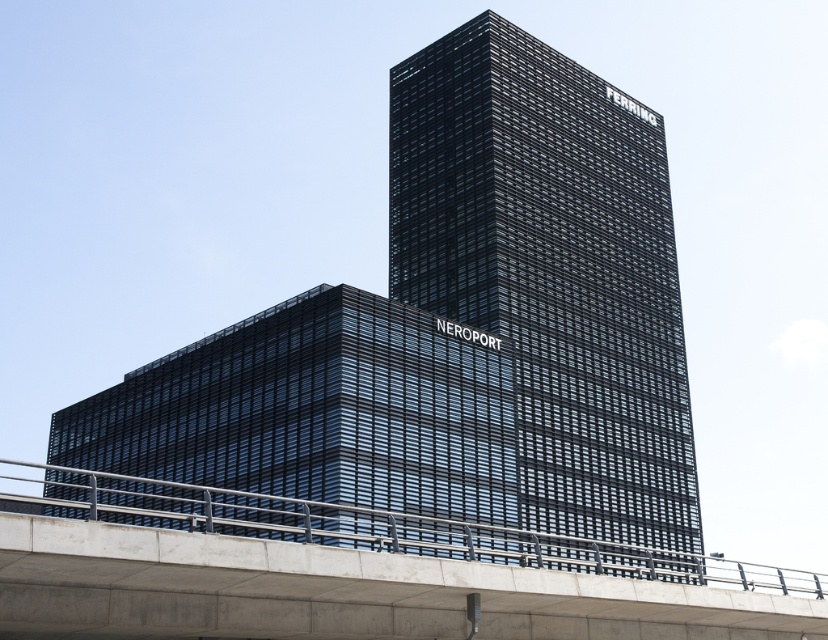
Question: Is black glass building at center below concrete bridge at lower center?

Choices:
 (A) yes
 (B) no

Answer: (B)

Question: Can you confirm if black glass building at center is positioned to the right of concrete bridge at lower center?

Choices:
 (A) yes
 (B) no

Answer: (A)

Question: Does black glass building at center come behind concrete bridge at lower center?

Choices:
 (A) no
 (B) yes

Answer: (B)

Question: Which point is closer to the camera taking this photo?

Choices:
 (A) (477, 554)
 (B) (629, 246)

Answer: (A)

Question: Which point is farther from the camera taking this photo?

Choices:
 (A) (97, 504)
 (B) (496, 269)

Answer: (B)